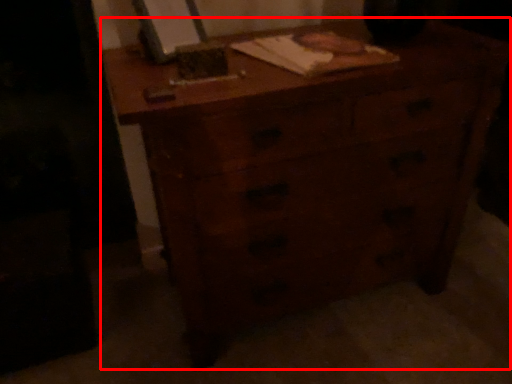
Question: Where is chest of drawers (annotated by the red box) located in relation to notebook in the image?

Choices:
 (A) left
 (B) right

Answer: (B)